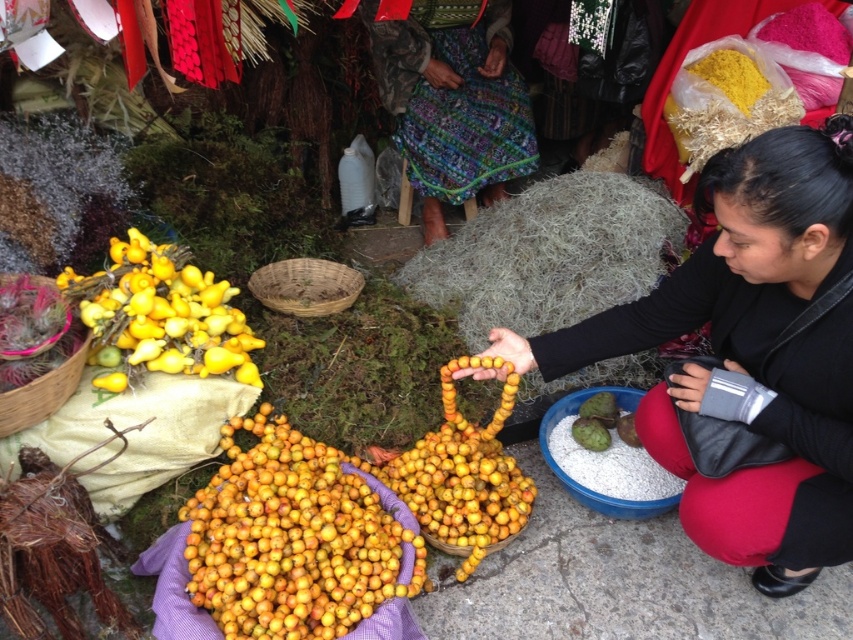
Can you confirm if yellow matte fruit at left is bigger than brown woven basket at left?

Correct, yellow matte fruit at left is larger in size than brown woven basket at left.

Between yellow matte fruit at left and brown woven basket at left, which one has less height?

With less height is brown woven basket at left.

Is point (154, 307) less distant than point (50, 392)?

No.

The image size is (853, 640). What are the coordinates of `yellow matte fruit at left` in the screenshot? It's located at (160, 314).

Can you confirm if black leather jacket at lower right is thinner than yellow matte fruit at left?

No, black leather jacket at lower right is not thinner than yellow matte fruit at left.

Which is above, black leather jacket at lower right or yellow matte fruit at left?

Positioned higher is yellow matte fruit at left.

The width and height of the screenshot is (853, 640). Describe the element at coordinates (751, 352) in the screenshot. I see `black leather jacket at lower right` at that location.

Where is `black leather jacket at lower right`? Image resolution: width=853 pixels, height=640 pixels. black leather jacket at lower right is located at coordinates (751, 352).

Which is above, yellow matte fruit at center or yellow matte fruit at left?

yellow matte fruit at left is above.

Which is below, yellow matte fruit at center or yellow matte fruit at left?

yellow matte fruit at center

Which is in front, point (352, 508) or point (126, 324)?

Positioned in front is point (352, 508).

Where is `yellow matte fruit at center`? yellow matte fruit at center is located at coordinates (291, 538).